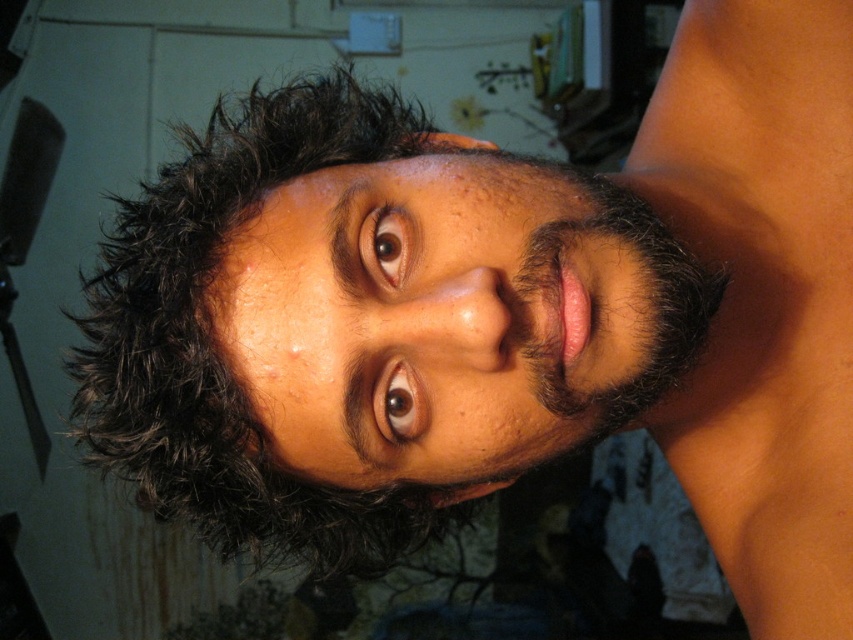
Which is more to the right, smooth skin at upper right or dark brown curly hair at upper center?

smooth skin at upper right

How far apart are smooth skin at upper right and dark brown curly hair at upper center?

The distance of smooth skin at upper right from dark brown curly hair at upper center is 22.28 centimeters.

Is point (723, 513) in front of point (97, 374)?

No, it is behind (97, 374).

The width and height of the screenshot is (853, 640). I want to click on smooth skin at upper right, so click(x=763, y=296).

Identify the location of brown matte eye at upper center. Image resolution: width=853 pixels, height=640 pixels. (387, 244).

In the scene shown: How distant is brown matte eye at upper center from brown matte eye at center?

brown matte eye at upper center and brown matte eye at center are 2.34 inches apart from each other.

Is point (396, 253) less distant than point (381, 433)?

That is True.

This screenshot has width=853, height=640. I want to click on brown matte eye at upper center, so click(x=387, y=244).

Based on the photo, is dry skin face at center wider than brown matte eye at center?

Yes, dry skin face at center is wider than brown matte eye at center.

Describe the element at coordinates (432, 321) in the screenshot. The height and width of the screenshot is (640, 853). I see `dry skin face at center` at that location.

This screenshot has width=853, height=640. Find the location of `dry skin face at center`. dry skin face at center is located at coordinates (432, 321).